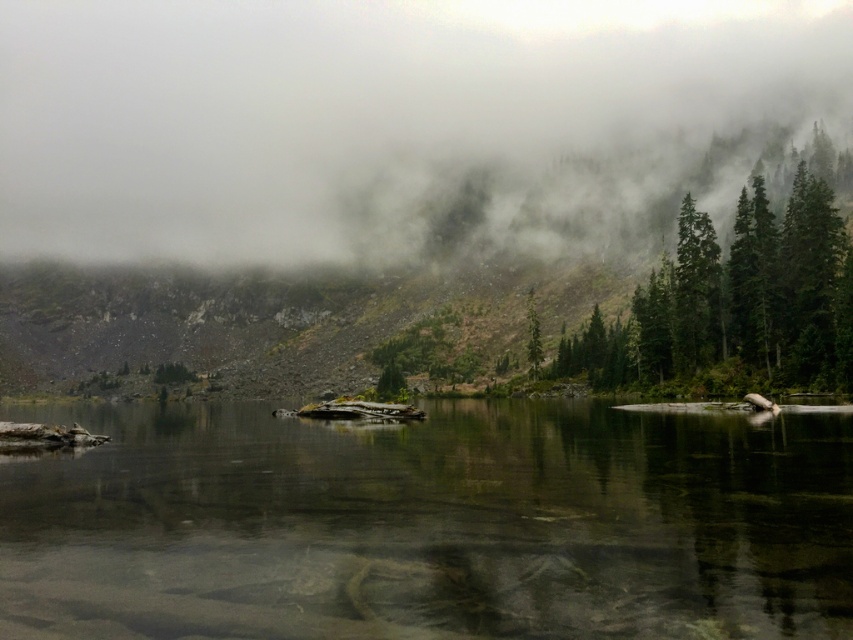
You are an environmental scientist assessing the landscape. You need to determine which area has a greater surface area based on the image. Which object has a larger size between the foggy misty forest at upper center and the green matte tree at center?

The foggy misty forest at upper center is larger in size than the green matte tree at center, so the foggy misty forest at upper center has a greater surface area.

You are standing at the edge of the water and want to take a photo of both the foggy misty forest at upper center and the green matte tree at center. Which object will appear closer to the camera in the photo?

The green matte tree at center will appear closer to the camera in the photo because it is positioned behind the foggy misty forest at upper center, meaning it is farther away from the camera compared to the forest.

You are a drone operator trying to capture the reflection of the small island in the clear water at center. Based on the scene description, where should you position the drone to ensure the reflection is fully visible in the image?

The clear water at center is located at point (430, 524), so you should position the drone directly above this coordinate to capture the reflection of the small island in the clear water at center.